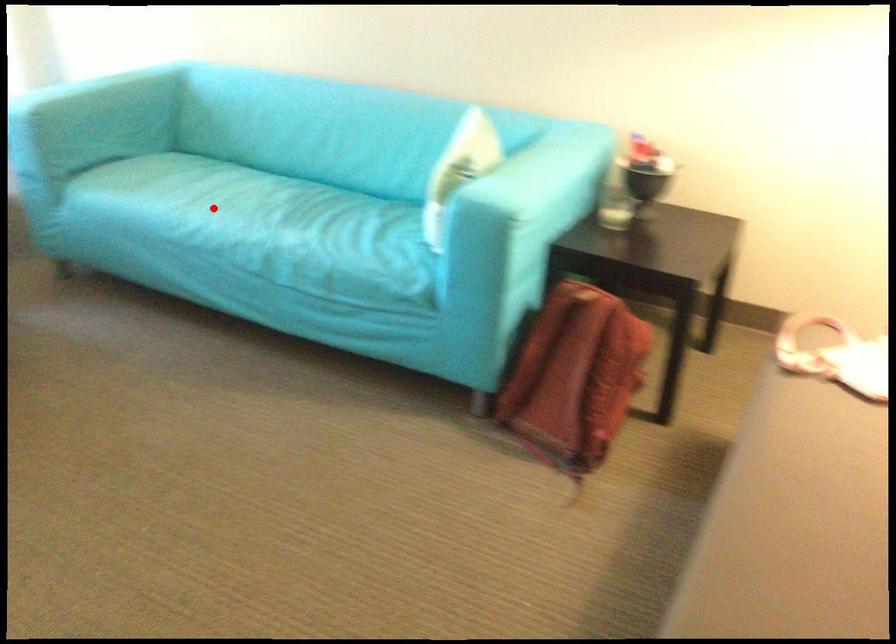
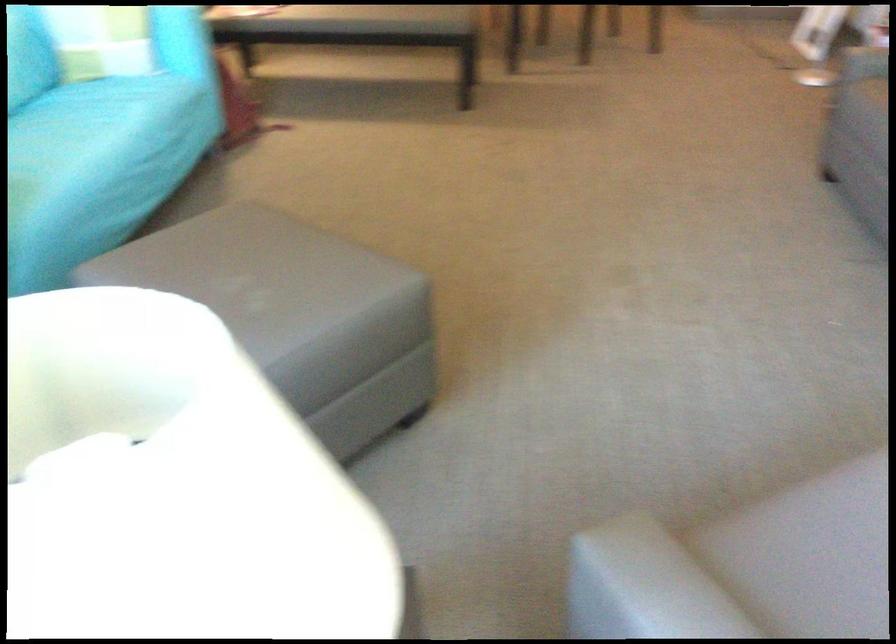
Where in the second image is the point corresponding to the highlighted location from the first image?

(87, 134)